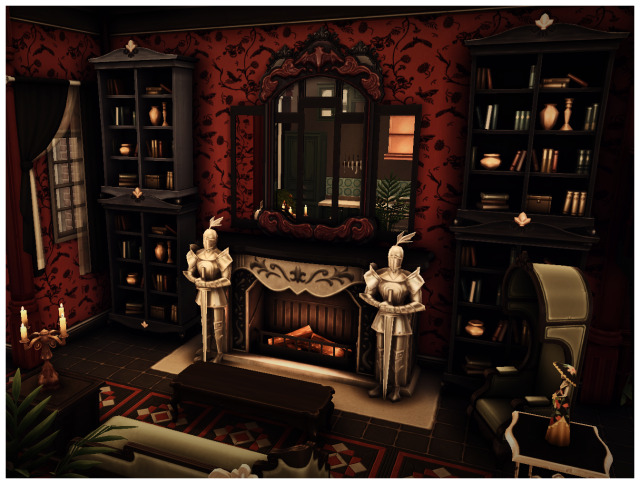
Find the location of a particular element. candle holder is located at coordinates (49, 359).